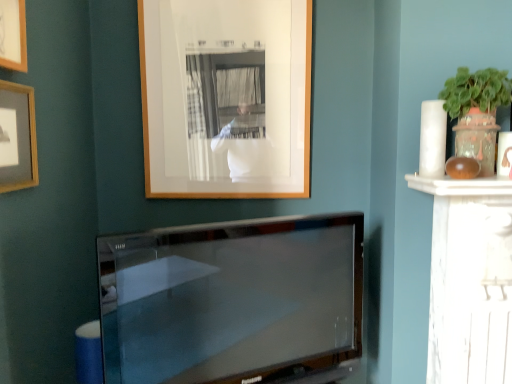
This screenshot has width=512, height=384. Describe the element at coordinates (13, 35) in the screenshot. I see `wooden picture frame at upper left, which is counted as the 2th picture frame, starting from the right` at that location.

Where is `wooden picture frame at upper center, positioned as the third picture frame in front-to-back order`? This screenshot has width=512, height=384. wooden picture frame at upper center, positioned as the third picture frame in front-to-back order is located at coordinates (226, 97).

Describe the element at coordinates (17, 137) in the screenshot. I see `matte wooden picture frame at upper left, which is the third picture frame in right-to-left order` at that location.

This screenshot has width=512, height=384. In order to click on satin black tv at center in this screenshot , I will do `click(231, 300)`.

Identify the location of wooden picture frame at upper left, which appears as the second picture frame when viewed from the left. (13, 35).

Is wooden picture frame at upper center, positioned as the third picture frame in front-to-back order, to the left of wooden picture frame at upper left, which is the third picture frame in back-to-front order, from the viewer's perspective?

No.

Which of these two, wooden picture frame at upper center, positioned as the third picture frame in front-to-back order, or wooden picture frame at upper left, which is the third picture frame in back-to-front order, is smaller?

wooden picture frame at upper left, which is the third picture frame in back-to-front order, is smaller.

Can we say wooden picture frame at upper center, arranged as the first picture frame when viewed from the right, lies outside wooden picture frame at upper left, which is the third picture frame in back-to-front order?

wooden picture frame at upper center, arranged as the first picture frame when viewed from the right, lies outside wooden picture frame at upper left, which is the third picture frame in back-to-front order,'s area.

From a real-world perspective, does wooden picture frame at upper center, which is the first picture frame in back-to-front order, sit lower than wooden picture frame at upper left, the first picture frame in the front-to-back sequence?

Correct, in the physical world, wooden picture frame at upper center, which is the first picture frame in back-to-front order, is lower than wooden picture frame at upper left, the first picture frame in the front-to-back sequence.

Is satin black tv at center a part of wooden picture frame at upper center, which is the first picture frame in back-to-front order?

Definitely not — satin black tv at center is not inside wooden picture frame at upper center, which is the first picture frame in back-to-front order.

Can you confirm if wooden picture frame at upper center, which appears as the 3th picture frame when viewed from the left, is taller than satin black tv at center?

Correct, wooden picture frame at upper center, which appears as the 3th picture frame when viewed from the left, is much taller as satin black tv at center.

From the image's perspective, does wooden picture frame at upper center, which is the first picture frame in back-to-front order, appear lower than satin black tv at center?

No.

Image resolution: width=512 pixels, height=384 pixels. Find the location of `the 2nd picture frame counting from the left of the satin black tv at center`. the 2nd picture frame counting from the left of the satin black tv at center is located at coordinates (13, 35).

Does point (5, 2) come farther from viewer compared to point (309, 354)?

No, it is in front of (309, 354).

Can you confirm if matte wooden picture frame at upper left, positioned as the 1th picture frame in left-to-right order, is smaller than wooden picture frame at upper left, which is the third picture frame in back-to-front order?

Incorrect, matte wooden picture frame at upper left, positioned as the 1th picture frame in left-to-right order, is not smaller in size than wooden picture frame at upper left, which is the third picture frame in back-to-front order.

In the scene shown: Which point is more forward, [4,84] or [18,64]?

Positioned in front is point [4,84].

From the image's perspective, would you say matte wooden picture frame at upper left, which ranks as the second picture frame in back-to-front order, is positioned over wooden picture frame at upper left, which is counted as the 2th picture frame, starting from the right?

No, from the image's perspective, matte wooden picture frame at upper left, which ranks as the second picture frame in back-to-front order, is not above wooden picture frame at upper left, which is counted as the 2th picture frame, starting from the right.

From the image's perspective, between wooden picture frame at upper left, which is counted as the 2th picture frame, starting from the right, and matte wooden picture frame at upper left, which is the third picture frame in right-to-left order, who is located below?

matte wooden picture frame at upper left, which is the third picture frame in right-to-left order, from the image's perspective.

Consider the image. Is wooden picture frame at upper left, which is the third picture frame in back-to-front order, looking in the opposite direction of matte wooden picture frame at upper left, the second picture frame positioned from the front?

wooden picture frame at upper left, which is the third picture frame in back-to-front order, is not turned away from matte wooden picture frame at upper left, the second picture frame positioned from the front.

Considering the sizes of objects wooden picture frame at upper left, which appears as the second picture frame when viewed from the left, and matte wooden picture frame at upper left, which is the third picture frame in right-to-left order, in the image provided, who is taller, wooden picture frame at upper left, which appears as the second picture frame when viewed from the left, or matte wooden picture frame at upper left, which is the third picture frame in right-to-left order,?

matte wooden picture frame at upper left, which is the third picture frame in right-to-left order.

Between wooden picture frame at upper left, which is the third picture frame in back-to-front order, and wooden picture frame at upper center, positioned as the third picture frame in front-to-back order, which one appears on the left side from the viewer's perspective?

wooden picture frame at upper left, which is the third picture frame in back-to-front order, is more to the left.

Could you measure the distance between wooden picture frame at upper left, which is the third picture frame in back-to-front order, and wooden picture frame at upper center, which appears as the 3th picture frame when viewed from the left?

wooden picture frame at upper left, which is the third picture frame in back-to-front order, and wooden picture frame at upper center, which appears as the 3th picture frame when viewed from the left, are 32.28 inches apart.

Does wooden picture frame at upper left, which appears as the second picture frame when viewed from the left, have a lesser width compared to wooden picture frame at upper center, arranged as the first picture frame when viewed from the right?

Yes.

Does wooden picture frame at upper left, which appears as the second picture frame when viewed from the left, turn towards wooden picture frame at upper center, which appears as the 3th picture frame when viewed from the left?

No.

Measure the distance from satin black tv at center to matte wooden picture frame at upper left, the second picture frame positioned from the front.

A distance of 82.62 centimeters exists between satin black tv at center and matte wooden picture frame at upper left, the second picture frame positioned from the front.

Consider the image. Which point is more forward, (288,350) or (21,176)?

The point (21,176) is closer.

Considering the sizes of objects satin black tv at center and matte wooden picture frame at upper left, which is the third picture frame in right-to-left order, in the image provided, who is shorter, satin black tv at center or matte wooden picture frame at upper left, which is the third picture frame in right-to-left order,?

With less height is matte wooden picture frame at upper left, which is the third picture frame in right-to-left order.

Is there a large distance between satin black tv at center and matte wooden picture frame at upper left, positioned as the 1th picture frame in left-to-right order?

No, there isn't a large distance between satin black tv at center and matte wooden picture frame at upper left, positioned as the 1th picture frame in left-to-right order.

From a real-world perspective, which picture frame is the 1st one underneath the wooden picture frame at upper left, which is the third picture frame in back-to-front order? Please provide its 2D coordinates.

[(226, 97)]

Locate an element on the screen. This screenshot has width=512, height=384. picture frame that appears behind the satin black tv at center is located at coordinates coord(226,97).

In the scene shown: From the image, which object appears to be nearer to satin black tv at center, wooden picture frame at upper left, which is the third picture frame in back-to-front order, or matte wooden picture frame at upper left, the second picture frame positioned from the front?

matte wooden picture frame at upper left, the second picture frame positioned from the front, lies closer to satin black tv at center than the other object.

Considering their positions, is matte wooden picture frame at upper left, positioned as the 1th picture frame in left-to-right order, positioned further to satin black tv at center than wooden picture frame at upper center, positioned as the third picture frame in front-to-back order?

Among the two, matte wooden picture frame at upper left, positioned as the 1th picture frame in left-to-right order, is located further to satin black tv at center.

Based on their spatial positions, is wooden picture frame at upper center, positioned as the third picture frame in front-to-back order, or matte wooden picture frame at upper left, which ranks as the second picture frame in back-to-front order, closer to wooden picture frame at upper left, which appears as the second picture frame when viewed from the left?

matte wooden picture frame at upper left, which ranks as the second picture frame in back-to-front order, is closer to wooden picture frame at upper left, which appears as the second picture frame when viewed from the left.

Based on their spatial positions, is satin black tv at center or wooden picture frame at upper left, which appears as the second picture frame when viewed from the left, further from wooden picture frame at upper center, which appears as the 3th picture frame when viewed from the left?

The object further to wooden picture frame at upper center, which appears as the 3th picture frame when viewed from the left, is wooden picture frame at upper left, which appears as the second picture frame when viewed from the left.

When comparing their distances from wooden picture frame at upper left, which appears as the second picture frame when viewed from the left, does satin black tv at center or matte wooden picture frame at upper left, which ranks as the second picture frame in back-to-front order, seem further?

satin black tv at center is positioned further to the anchor wooden picture frame at upper left, which appears as the second picture frame when viewed from the left.

In the scene shown: Considering their positions, is matte wooden picture frame at upper left, positioned as the 1th picture frame in left-to-right order, positioned closer to satin black tv at center than wooden picture frame at upper left, the first picture frame in the front-to-back sequence?

matte wooden picture frame at upper left, positioned as the 1th picture frame in left-to-right order, lies closer to satin black tv at center than the other object.

Which object lies nearer to the anchor point satin black tv at center, wooden picture frame at upper left, which appears as the second picture frame when viewed from the left, or wooden picture frame at upper center, arranged as the first picture frame when viewed from the right?

wooden picture frame at upper center, arranged as the first picture frame when viewed from the right, lies closer to satin black tv at center than the other object.

When comparing their distances from wooden picture frame at upper center, positioned as the third picture frame in front-to-back order, does wooden picture frame at upper left, which is counted as the 2th picture frame, starting from the right, or matte wooden picture frame at upper left, which ranks as the second picture frame in back-to-front order, seem closer?

matte wooden picture frame at upper left, which ranks as the second picture frame in back-to-front order.

Identify the location of picture frame between wooden picture frame at upper left, the first picture frame in the front-to-back sequence, and wooden picture frame at upper center, which appears as the 3th picture frame when viewed from the left, in the front-back direction. (17, 137).

The width and height of the screenshot is (512, 384). In order to click on television located between matte wooden picture frame at upper left, positioned as the 1th picture frame in left-to-right order, and wooden picture frame at upper center, arranged as the first picture frame when viewed from the right, in the depth direction in this screenshot , I will do `click(231, 300)`.